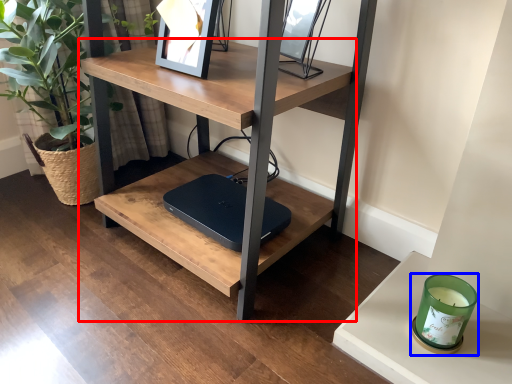
Question: Which of the following is the farthest to the observer, table (highlighted by a red box) or candle holder (highlighted by a blue box)?

Choices:
 (A) table
 (B) candle holder

Answer: (B)